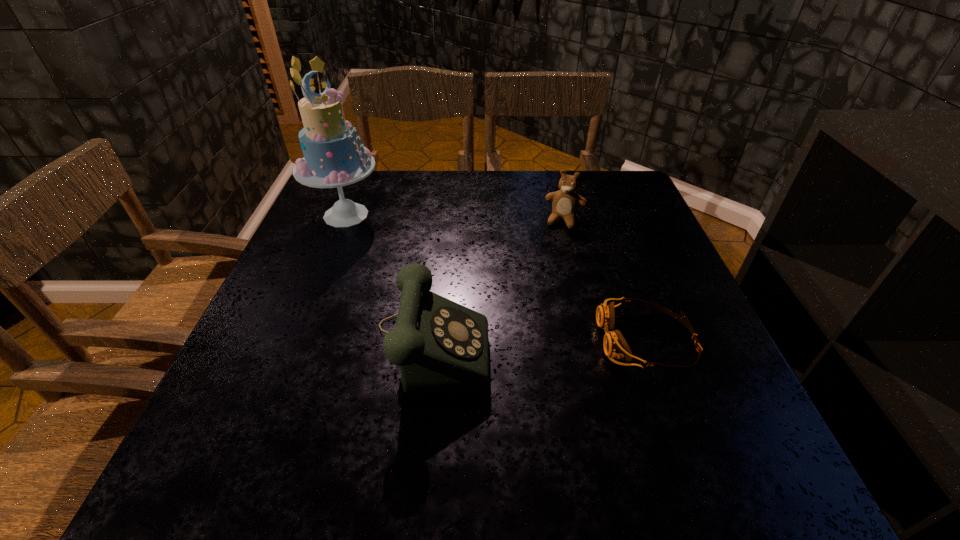
Identify the location of free space on the desktop that is between the third shortest object and the shortest object and is positioned on the front-facing side of the teddy bear. The height and width of the screenshot is (540, 960). (531, 339).

I want to click on vacant space on the desktop that is between the second tallest object and the shortest object and is positioned with a ladder on the side of the cake, so click(531, 339).